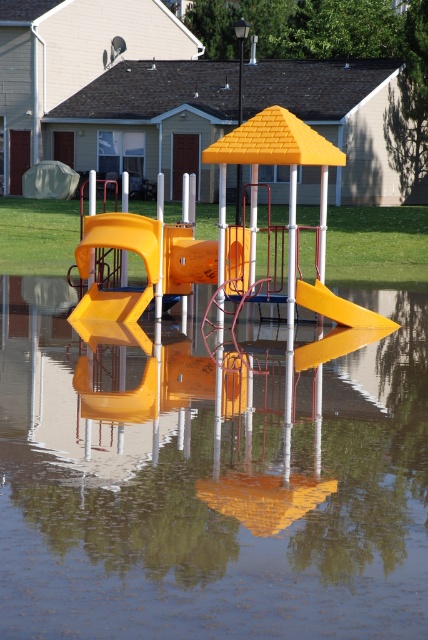
You are a maintenance worker assessing the flooded playground. You need to reach the slide to check its structural integrity. The slide is part of the playground equipment described in the scene. Given that the transparent plastic water at center is between you and the slide, can you safely walk across the water to reach the slide?

The transparent plastic water at center is 6.19 meters away from viewer. Since the water is only 6.19 meters away, it is possible to walk across the water to reach the slide, assuming the water depth is manageable and there are no hidden hazards.

You are a maintenance worker inspecting the playground after a flood. You notice the point at coordinates (211, 484). What is the material at this point?

The material at point (211, 484) is transparent plastic water at center.

You are a maintenance worker assessing the flooded playground. You need to check the yellow matte slide at center for damage. Since the transparent plastic water at center is in the way, can you step around it to reach the slide?

The transparent plastic water at center is located below the yellow matte slide at center, so you can step around the water to reach the slide as the water is underneath the slide and not blocking the sides.